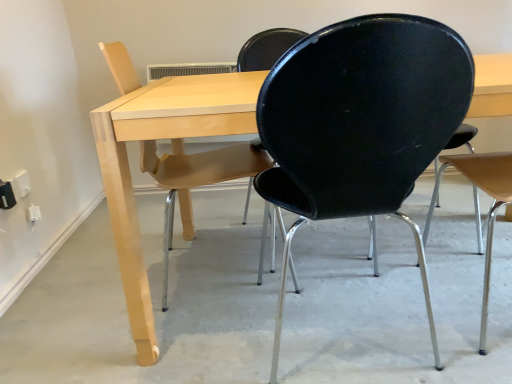
Identify the location of blank space above smooth concrete floor at center (from a real-world perspective). This screenshot has width=512, height=384. (273, 288).